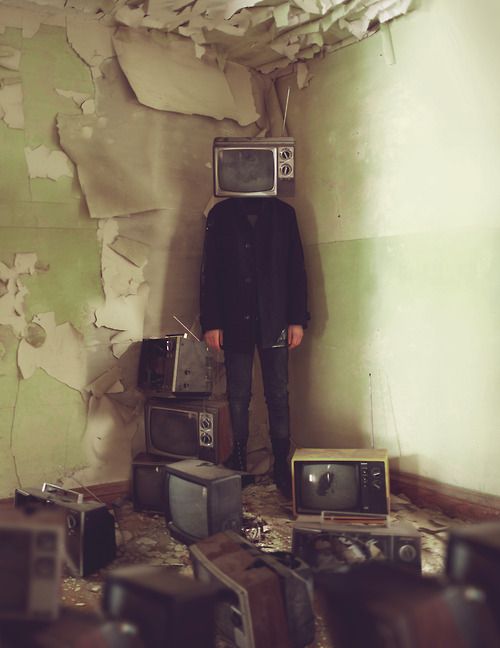
Find the location of a particular element. television sets is located at coordinates (199, 361), (172, 429), (187, 505), (151, 481), (161, 629), (236, 580), (338, 483), (248, 185).